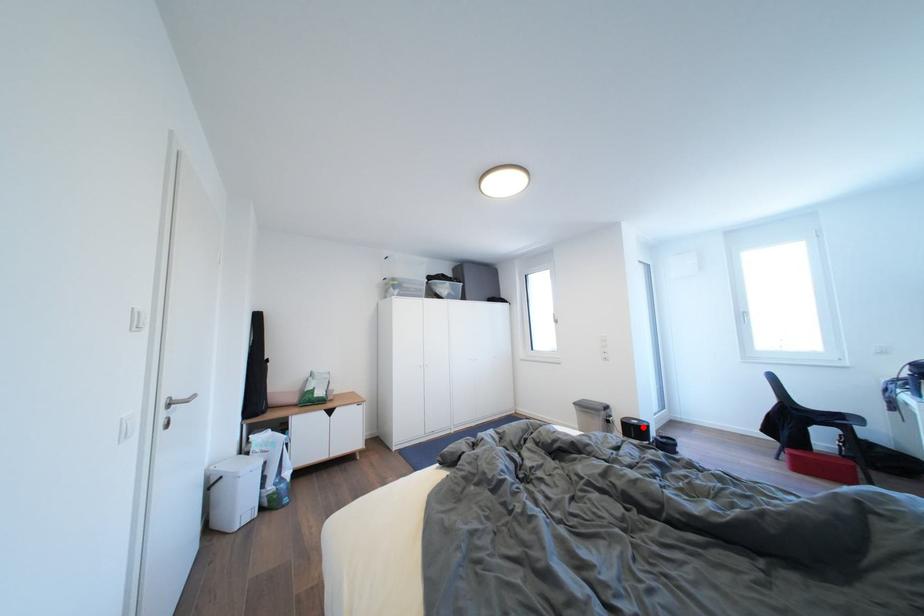
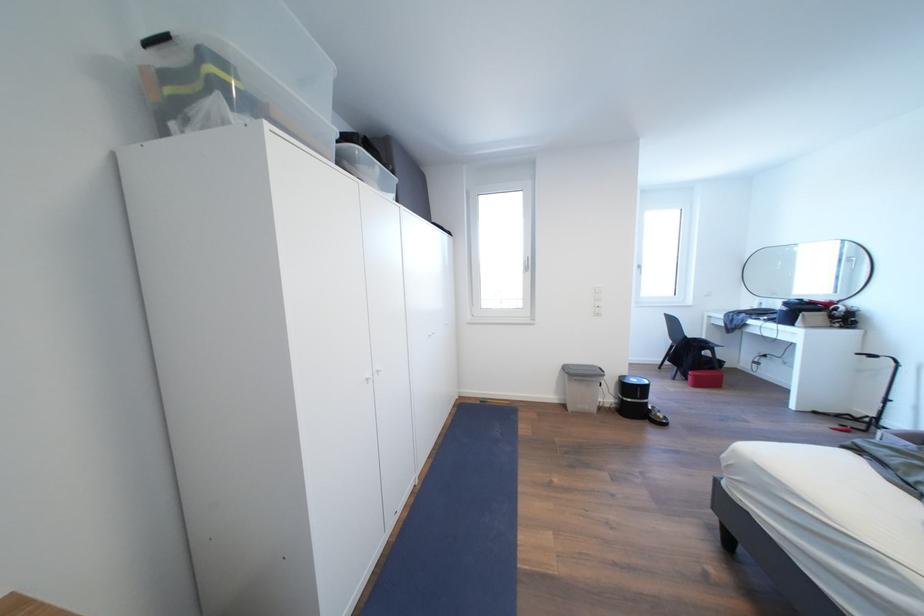
The point at the highlighted location is marked in the first image. Where is the corresponding point in the second image?

(641, 386)